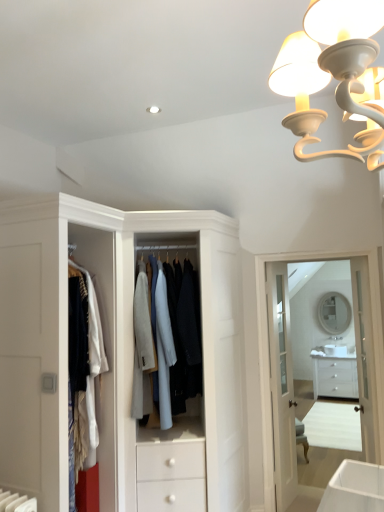
Question: Should I look upward or downward to see white glossy medicine cabinet at upper center?

Choices:
 (A) up
 (B) down

Answer: (B)

Question: Should I look upward or downward to see light blue fabric coat at center?

Choices:
 (A) down
 (B) up

Answer: (A)

Question: Is white glossy chest of drawers at lower right bigger than matte white mirror at center?

Choices:
 (A) yes
 (B) no

Answer: (A)

Question: Is white glossy chest of drawers at lower right smaller than matte white mirror at center?

Choices:
 (A) no
 (B) yes

Answer: (A)

Question: Is white glossy chest of drawers at lower right oriented away from matte white mirror at center?

Choices:
 (A) yes
 (B) no

Answer: (B)

Question: Can you confirm if white glossy chest of drawers at lower right is thinner than matte white mirror at center?

Choices:
 (A) no
 (B) yes

Answer: (A)

Question: Is the depth of white glossy chest of drawers at lower right less than that of matte white mirror at center?

Choices:
 (A) no
 (B) yes

Answer: (B)

Question: Is white glossy chest of drawers at lower right aimed at matte white mirror at center?

Choices:
 (A) no
 (B) yes

Answer: (A)

Question: Is the depth of white glossy medicine cabinet at upper center greater than that of white glossy chest of drawers at lower right?

Choices:
 (A) no
 (B) yes

Answer: (A)

Question: Does white glossy medicine cabinet at upper center have a greater height compared to white glossy chest of drawers at lower right?

Choices:
 (A) no
 (B) yes

Answer: (B)

Question: From a real-world perspective, is white glossy medicine cabinet at upper center positioned over white glossy chest of drawers at lower right based on gravity?

Choices:
 (A) yes
 (B) no

Answer: (A)

Question: Is there a large distance between white glossy medicine cabinet at upper center and white glossy chest of drawers at lower right?

Choices:
 (A) yes
 (B) no

Answer: (B)

Question: Are white glossy medicine cabinet at upper center and white glossy chest of drawers at lower right making contact?

Choices:
 (A) no
 (B) yes

Answer: (A)

Question: Is white glossy medicine cabinet at upper center not within white glossy chest of drawers at lower right?

Choices:
 (A) yes
 (B) no

Answer: (A)

Question: From the image's perspective, is white glossy door at center, acting as the first door starting from the left, on light blue fabric coat at center?

Choices:
 (A) no
 (B) yes

Answer: (A)